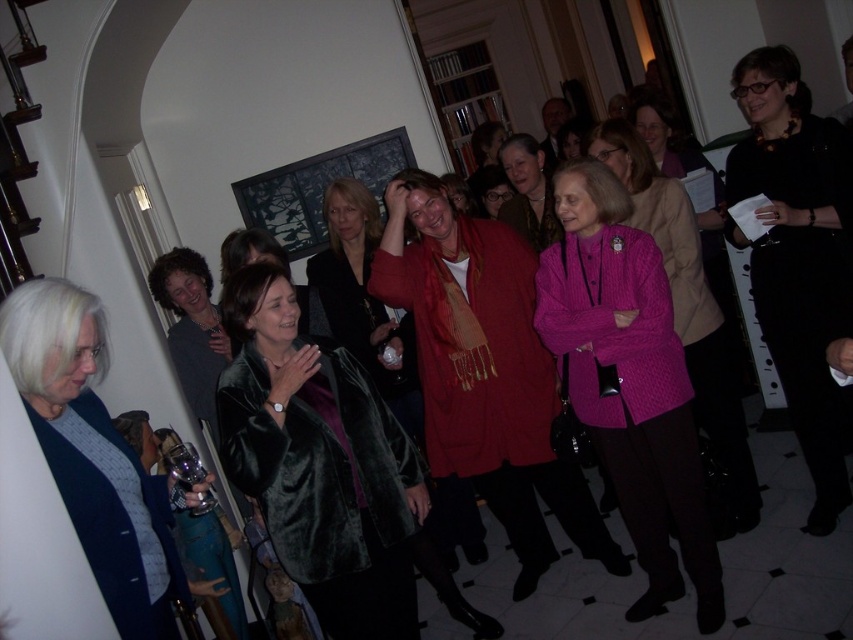
You are a photographer at the event and need to capture a photo that includes both the black velvet dress at center and the knitted pink sweater at center. Which clothing item should you focus on first to ensure it appears taller in the photo?

The black velvet dress at center is taller than the knitted pink sweater at center, so focusing on it first will ensure it appears taller in the photo.